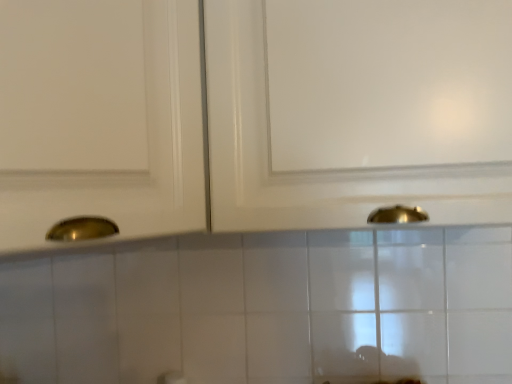
The height and width of the screenshot is (384, 512). In order to click on matte gold cabinet handle at left in this screenshot , I will do `click(100, 118)`.

This screenshot has height=384, width=512. Describe the element at coordinates (100, 118) in the screenshot. I see `matte gold cabinet handle at left` at that location.

At what (x,y) coordinates should I click in order to perform the action: click on matte gold cabinet handle at left. Please return your answer as a coordinate pair (x, y). This screenshot has width=512, height=384. Looking at the image, I should click on (100, 118).